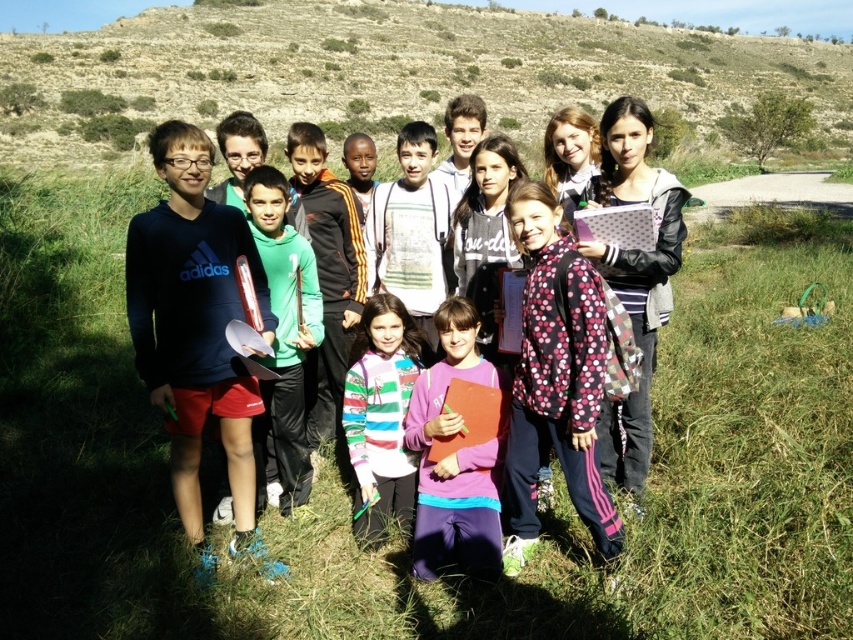
Between point (494, 588) and point (165, 138), which one is positioned in front?

Point (494, 588) is in front.

Where is `pink polka dot jacket at center`? This screenshot has height=640, width=853. pink polka dot jacket at center is located at coordinates (395, 538).

Find the location of a particular element. Image resolution: width=853 pixels, height=640 pixels. pink polka dot jacket at center is located at coordinates (395, 538).

Is green fleece jacket at center positioned in front of striped sweater at center?

No.

Image resolution: width=853 pixels, height=640 pixels. I want to click on green fleece jacket at center, so click(x=283, y=333).

Which is in front, point (624, 125) or point (381, 449)?

Positioned in front is point (381, 449).

Can you confirm if pink polka dot scarf at center is bigger than striped sweater at center?

→ Yes, pink polka dot scarf at center is bigger than striped sweater at center.

Is point (660, 273) positioned in front of point (358, 474)?

No, it is not.

Identify the location of pink polka dot scarf at center. (633, 278).